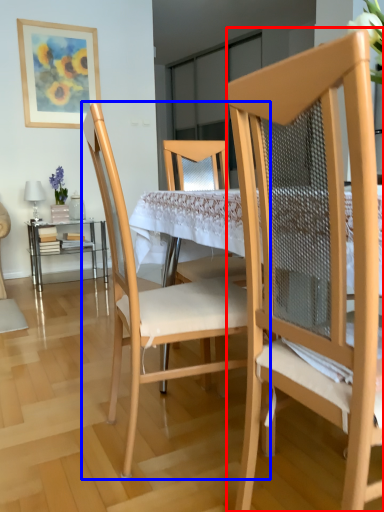
Question: Which object is closer to the camera taking this photo, chair (highlighted by a red box) or chair (highlighted by a blue box)?

Choices:
 (A) chair
 (B) chair

Answer: (A)